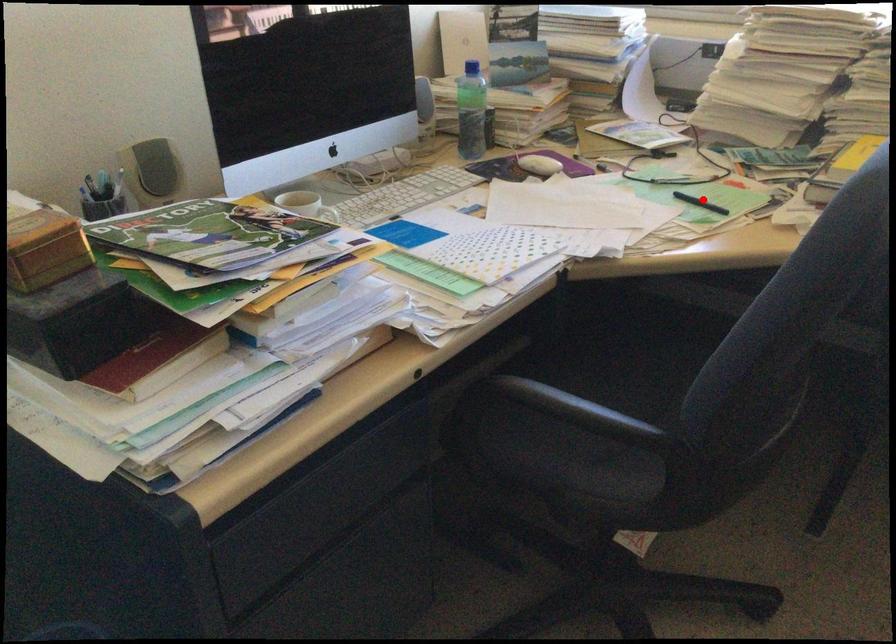
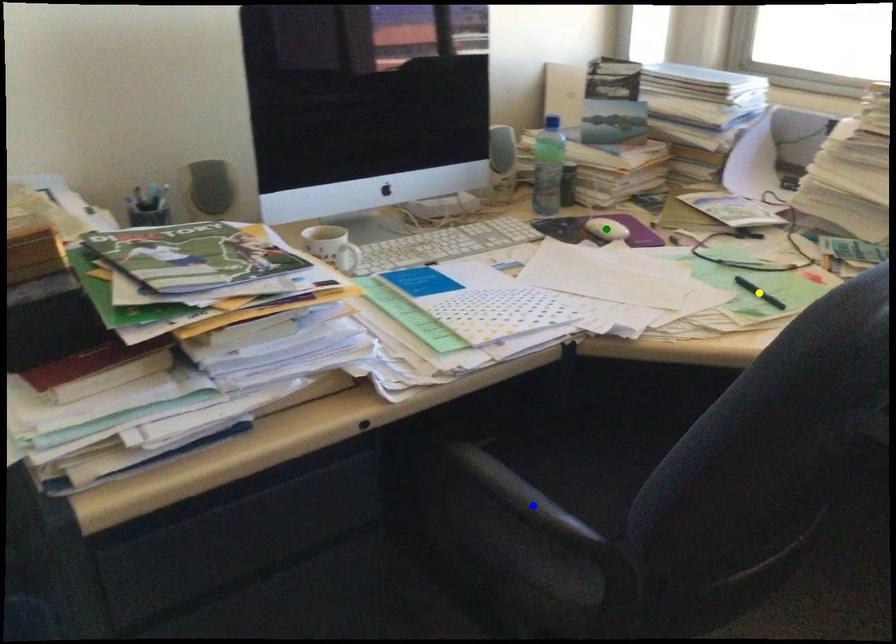
Question: I am providing you with two images of the same scene from different viewpoints. A red point is marked on the first image. You are given multiple points on the second image. In image 2, which mark is for the same physical point as the one in image 1?

Choices:
 (A) green point
 (B) blue point
 (C) yellow point

Answer: (C)